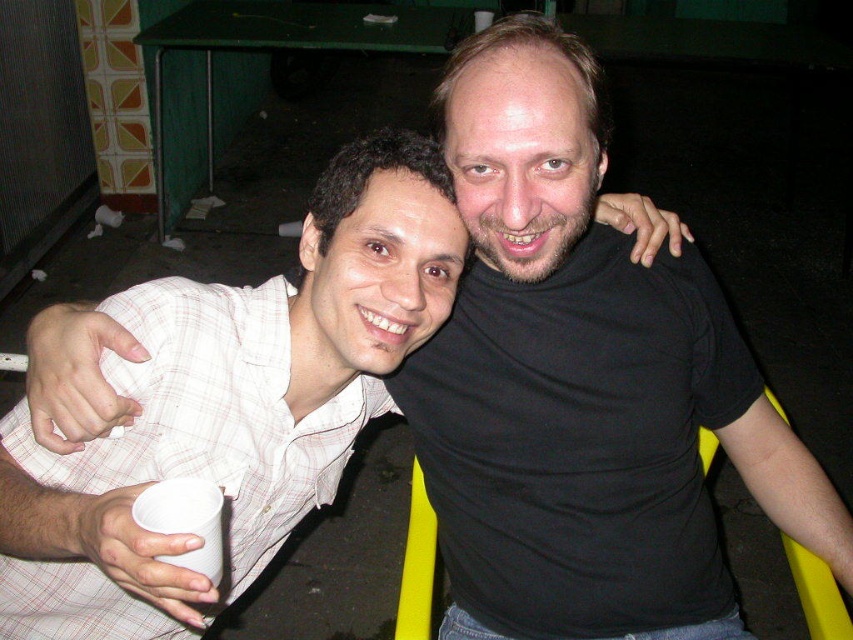
Question: Among these points, which one is farthest from the camera?

Choices:
 (A) (657, 480)
 (B) (236, 312)

Answer: (A)

Question: Is black matte shirt at upper right positioned before white checkered shirt at left?

Choices:
 (A) yes
 (B) no

Answer: (A)

Question: Is black matte shirt at upper right smaller than white checkered shirt at left?

Choices:
 (A) yes
 (B) no

Answer: (B)

Question: Can you confirm if black matte shirt at upper right is positioned to the left of white checkered shirt at left?

Choices:
 (A) no
 (B) yes

Answer: (A)